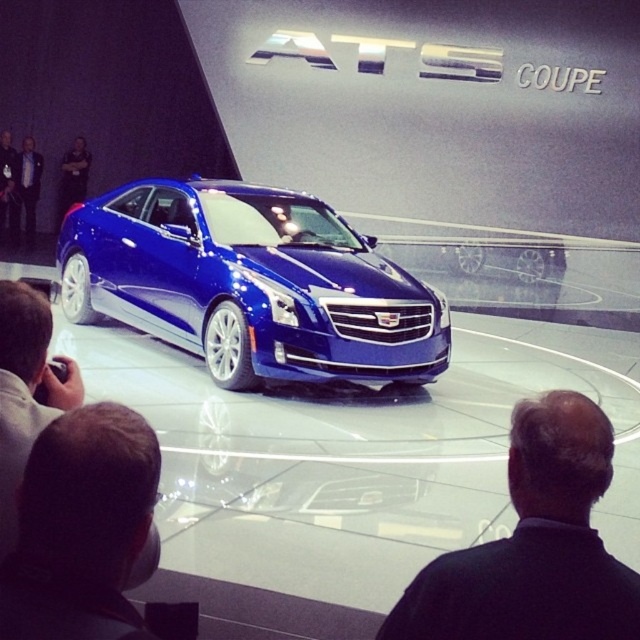
Question: Considering the real-world distances, which object is closest to the smooth skin head at lower left?

Choices:
 (A) glossy metallic blue car at center
 (B) dark blue suit at left

Answer: (A)

Question: Based on their relative distances, which object is nearer to the dark blue suit at left?

Choices:
 (A) glossy metallic blue car at center
 (B) light gray fabric jacket at lower left
 (C) black fabric coat at center

Answer: (A)

Question: Can you confirm if black fabric coat at center is thinner than dark blue suit at left?

Choices:
 (A) yes
 (B) no

Answer: (A)

Question: Does black fabric coat at center appear on the right side of smooth skin head at lower left?

Choices:
 (A) no
 (B) yes

Answer: (B)

Question: Does light gray fabric jacket at lower left have a lesser width compared to black leather jacket at upper left?

Choices:
 (A) no
 (B) yes

Answer: (B)

Question: Which point is closer to the camera?

Choices:
 (A) smooth skin head at lower left
 (B) dark blue suit at left
 (C) black leather jacket at upper left

Answer: (A)